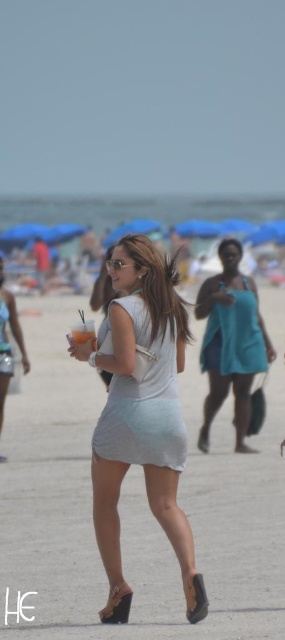
Question: Based on their relative distances, which object is farther from the light blue fabric dress at center?

Choices:
 (A) teal matte dress at center
 (B) teal fabric dress at center
 (C) light gray fabric dress at center

Answer: (B)

Question: Does teal fabric dress at center appear on the left side of light gray fabric dress at center?

Choices:
 (A) yes
 (B) no

Answer: (B)

Question: Is light gray fabric dress at center smaller than teal matte dress at center?

Choices:
 (A) yes
 (B) no

Answer: (A)

Question: Which point is closer to the camera?

Choices:
 (A) (161, 435)
 (B) (237, 330)
 (C) (247, 330)

Answer: (A)

Question: Does teal fabric dress at center have a larger size compared to light gray fabric dress at center?

Choices:
 (A) no
 (B) yes

Answer: (A)

Question: Which point is closer to the camera?

Choices:
 (A) light gray fabric dress at center
 (B) teal fabric dress at center

Answer: (A)